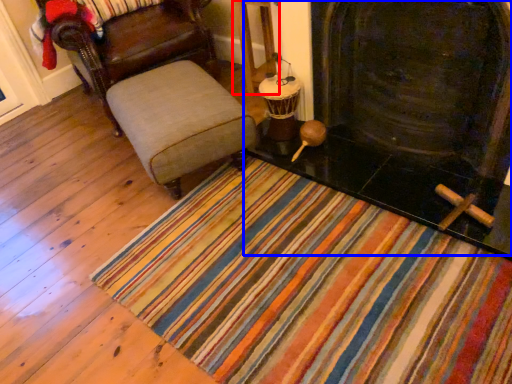
Question: Among these objects, which one is nearest to the camera, table (highlighted by a red box) or fireplace (highlighted by a blue box)?

Choices:
 (A) table
 (B) fireplace

Answer: (B)